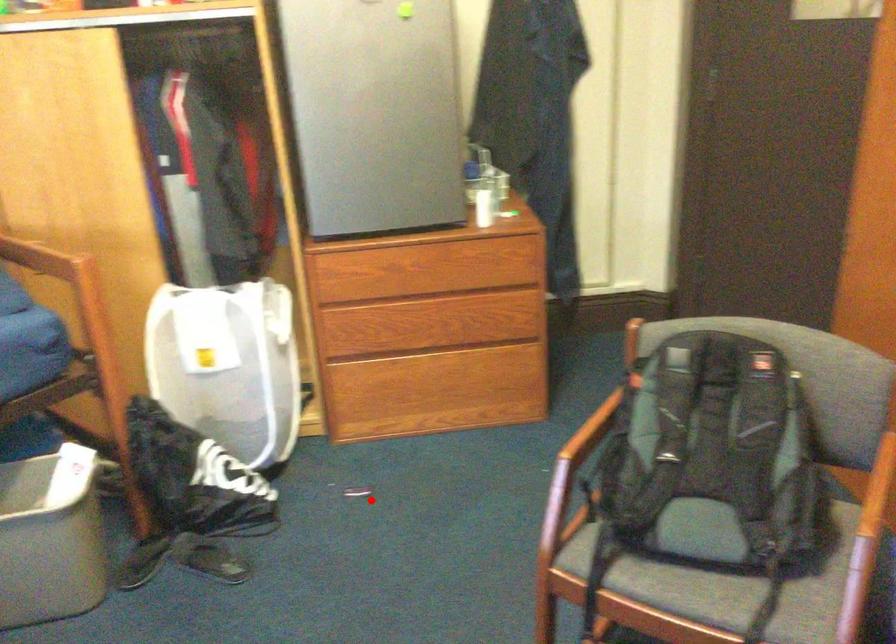
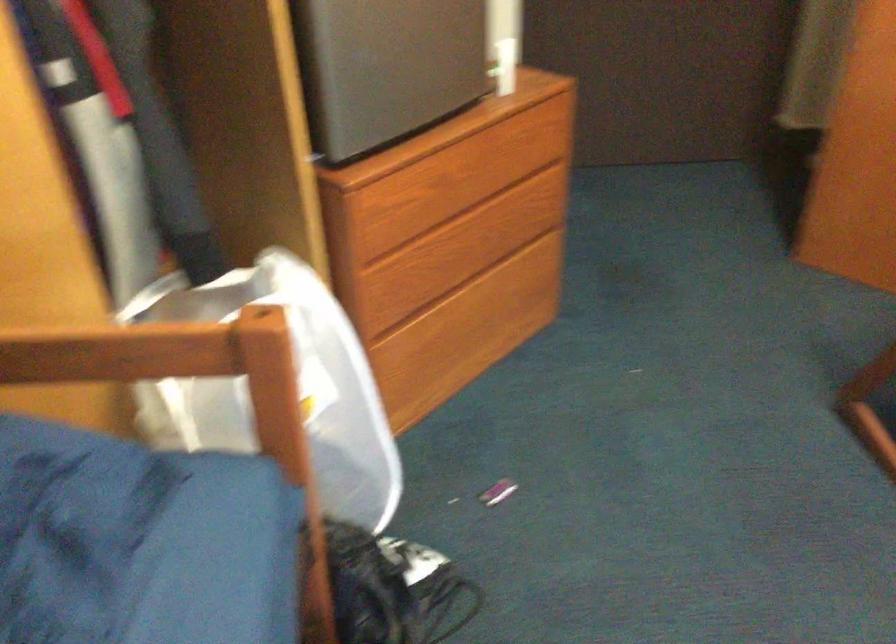
Question: I am providing you with two images of the same scene from different viewpoints. Image1 has a red point marked. In image2, the corresponding 3D location appears at what relative position? Reply with the corresponding letter.

Choices:
 (A) Closer
 (B) Farther

Answer: (A)